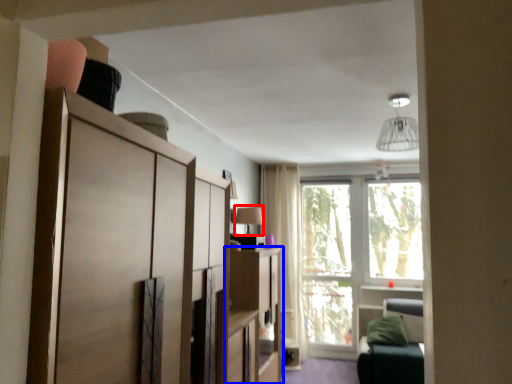
Question: Which object appears closest to the camera in this image, lamp (highlighted by a red box) or cabinetry (highlighted by a blue box)?

Choices:
 (A) lamp
 (B) cabinetry

Answer: (B)